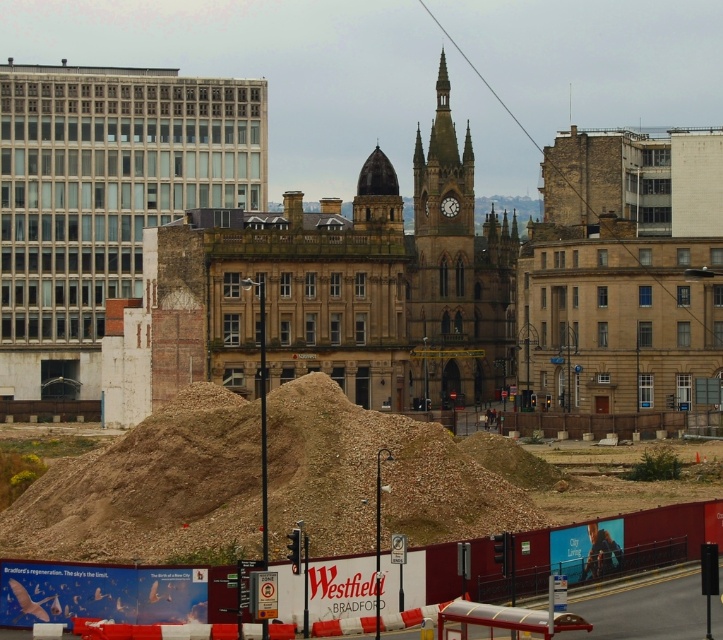
You are a construction worker standing at the edge of the brown gravel mound at center. You need to move materials to the base of the brown stone clock tower at center. Based on the scene, can you directly access the base of the tower from the mound without needing to go around?

The brown gravel mound at center is positioned under brown stone clock tower at center, so yes, you can directly access the base of the tower from the mound without needing to go around.

You are standing in the urban scene and want to take a photo of both the matte glass building at left and the brown stone clock tower at center. Which building should you position yourself to the left of to capture both in your shot?

You should position yourself to the left of the matte glass building at left to capture both buildings in your shot since the matte glass building at left is to the left of the brown stone clock tower at center.

You are a construction worker needing to place a heavy equipment on the ground. The equipment requires a stable and level surface. Given the brown gravel mound at center and the smooth stone dome at center, which location would be more suitable for placing the equipment?

The smooth stone dome at center is more suitable because it has a stable and level surface, whereas the brown gravel mound at center is uneven and disturbed due to construction work.